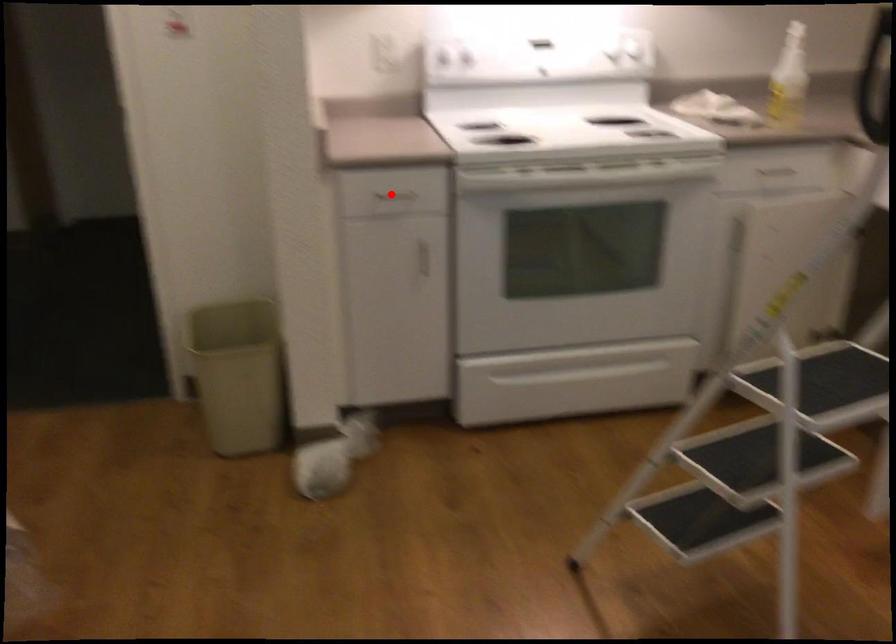
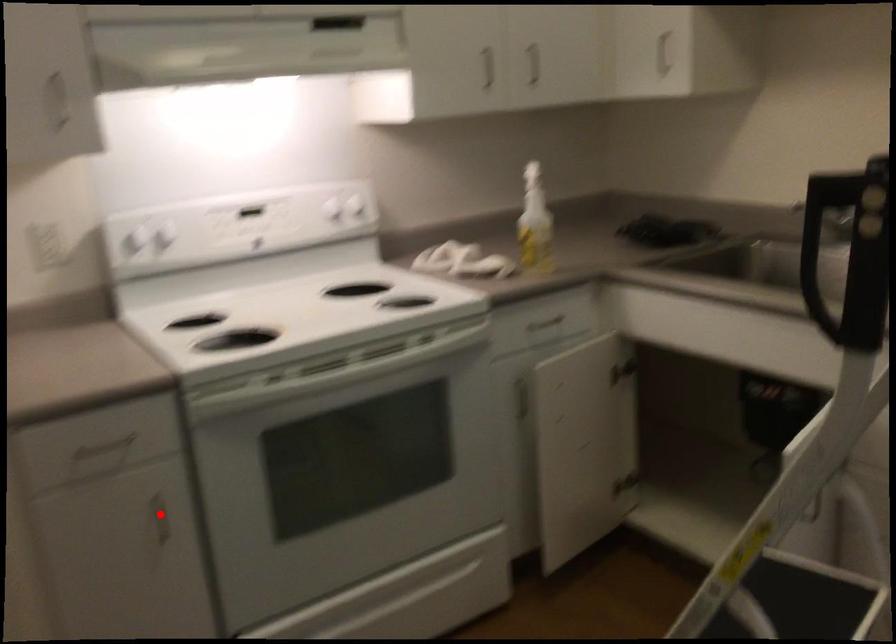
Based on the photo, I am providing you with two images of the same scene from different viewpoints. A red point is marked on the first image and another point is marked on the second image. Are the points marked in image1 and image2 representing the same 3D position?

No